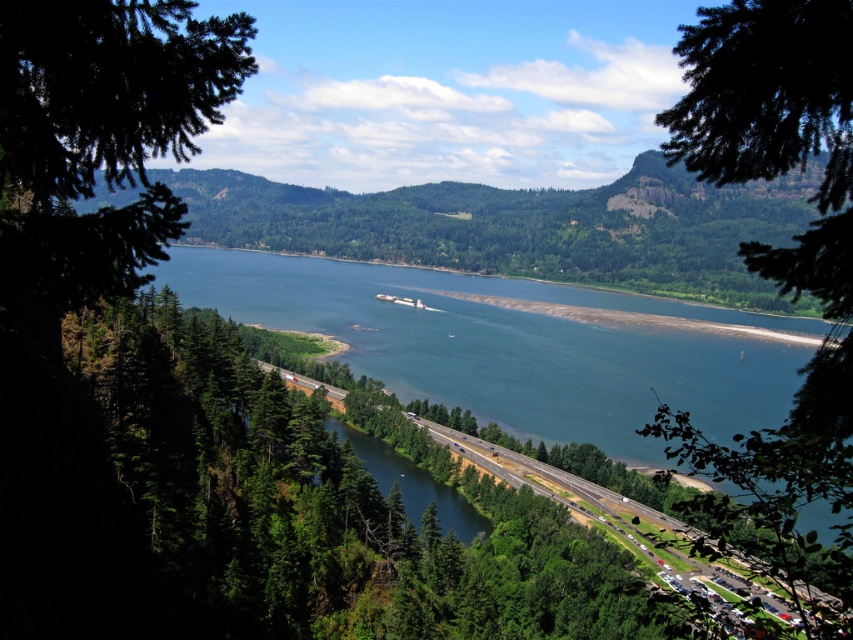
You are standing at the point closer to the bottom of the image and want to look towards the horizon. Which point, point (788,337) or point (813,65), is closer to the horizon?

Point (788,337) is behind point (813,65), so the point closer to the horizon would be point (788,337).